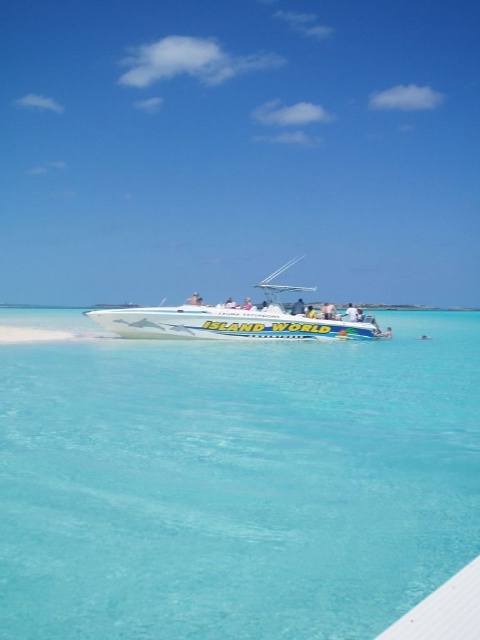
You are a passenger on the white glossy speedboat at center. You want to jump into the clear blue water at center. Is the water in front of the boat safe to jump into?

The clear blue water at center is in front of the white glossy speedboat at center, so yes, the water in front of the boat is safe to jump into.

You are a passenger on the white glossy speedboat at center and want to see the underwater view. Which direction should you look to see the clear blue water at center?

The clear blue water at center is located below the white glossy speedboat at center, so you should look downward to see the clear blue water at center.